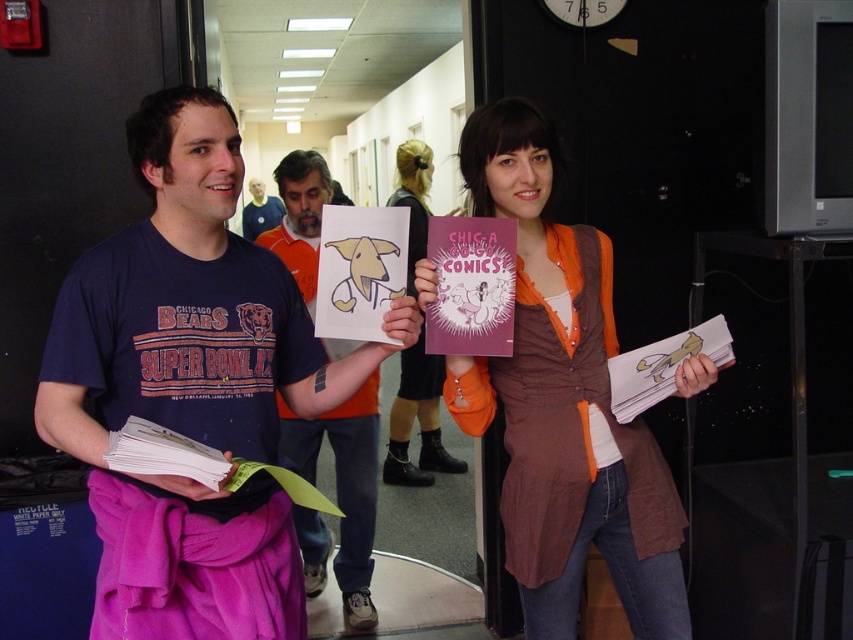
Based on the scene description, what is the color of the fabric at the point indicated by coordinates point (563,401)?

The point (563,401) indicates brown fabric shirt at center.

You are an interior designer observing the scene. You need to determine the vertical arrangement of the brown fabric shirt at center and the matte pink skirt at center. Which one is positioned higher?

The brown fabric shirt at center is located above the matte pink skirt at center, so it is positioned higher.